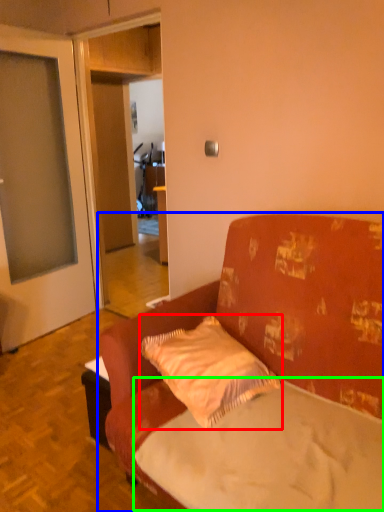
Question: Based on their relative distances, which object is nearer to pillow (highlighted by a red box)? Choose from studio couch (highlighted by a blue box) and mattress (highlighted by a green box).

Choices:
 (A) studio couch
 (B) mattress

Answer: (A)